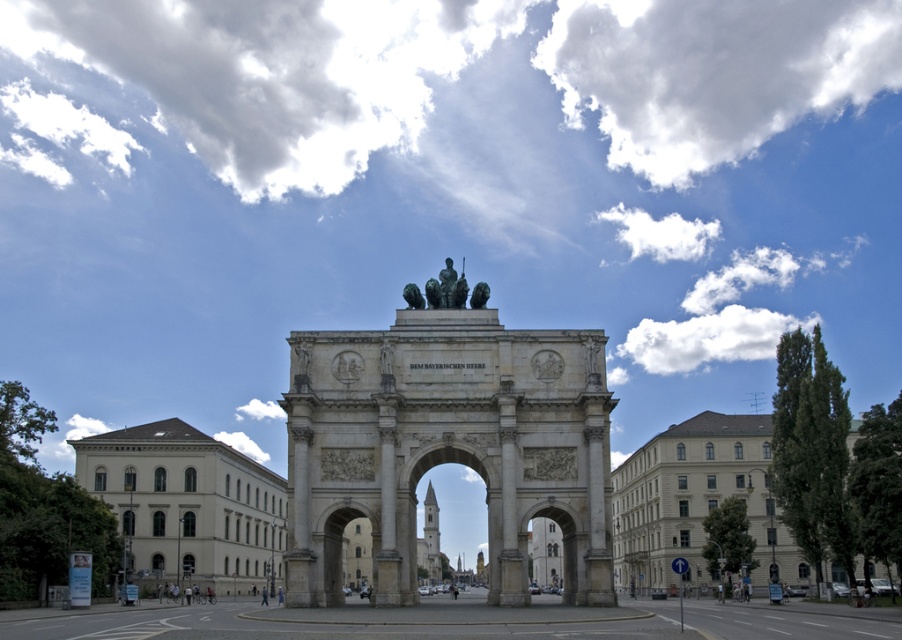
Question: Where is green stone arch at center located in relation to bronze statue at center in the image?

Choices:
 (A) below
 (B) above

Answer: (A)

Question: Which point appears closest to the camera in this image?

Choices:
 (A) (421, 384)
 (B) (410, 282)
 (C) (474, 298)

Answer: (A)

Question: Among these points, which one is nearest to the camera?

Choices:
 (A) (419, 305)
 (B) (324, 486)
 (C) (439, 300)

Answer: (B)

Question: Is green patina statue at center further to camera compared to bronze statue at center?

Choices:
 (A) no
 (B) yes

Answer: (A)

Question: Which point is farther to the camera?

Choices:
 (A) green stone arch at center
 (B) bronze statue at center

Answer: (B)

Question: Is green stone arch at center wider than bronze statue at center?

Choices:
 (A) no
 (B) yes

Answer: (B)